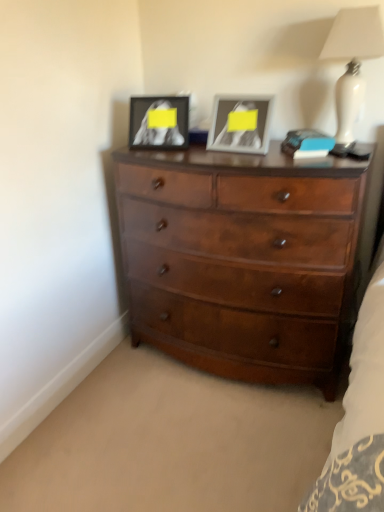
Describe the element at coordinates (240, 124) in the screenshot. I see `metallic silver picture frame at upper center, the second picture frame viewed from the left` at that location.

In order to face matte black picture frame at upper center, the 1th picture frame viewed from the left, should I rotate leftwards or rightwards?

To align with it, rotate left about 4.799°.

Describe the element at coordinates (307, 144) in the screenshot. The width and height of the screenshot is (384, 512). I see `blue matte book at upper right` at that location.

In order to click on shiny brown wooden chest of drawers at center in this screenshot , I will do `click(241, 259)`.

This screenshot has height=512, width=384. What are the coordinates of `white glossy lamp at upper right` in the screenshot? It's located at (352, 61).

Consider the image. Which object is positioned more to the left, white glossy lamp at upper right or metallic silver picture frame at upper center, arranged as the first picture frame when viewed from the right?

metallic silver picture frame at upper center, arranged as the first picture frame when viewed from the right.

Where is `the 2nd picture frame positioned below the white glossy lamp at upper right (from the image's perspective)`? the 2nd picture frame positioned below the white glossy lamp at upper right (from the image's perspective) is located at coordinates (240, 124).

Is white glossy lamp at upper right far away from metallic silver picture frame at upper center, the second picture frame viewed from the left?

No, there isn't a large distance between white glossy lamp at upper right and metallic silver picture frame at upper center, the second picture frame viewed from the left.

Is blue matte book at upper right further to camera compared to shiny brown wooden chest of drawers at center?

Yes, it is behind shiny brown wooden chest of drawers at center.

Could you tell me if blue matte book at upper right is facing shiny brown wooden chest of drawers at center?

No, blue matte book at upper right is not aimed at shiny brown wooden chest of drawers at center.

Consider the image. Which point is more distant from viewer, (295,141) or (274,212)?

The point (295,141) is farther from the camera.

Can you confirm if blue matte book at upper right is wider than shiny brown wooden chest of drawers at center?

In fact, blue matte book at upper right might be narrower than shiny brown wooden chest of drawers at center.

Is point (235, 122) behind point (329, 150)?

Yes.

Can we say metallic silver picture frame at upper center, the second picture frame viewed from the left, lies outside blue matte book at upper right?

Absolutely, metallic silver picture frame at upper center, the second picture frame viewed from the left, is external to blue matte book at upper right.

Is the surface of metallic silver picture frame at upper center, arranged as the first picture frame when viewed from the right, in direct contact with blue matte book at upper right?

No, metallic silver picture frame at upper center, arranged as the first picture frame when viewed from the right, is not beside blue matte book at upper right.

Between metallic silver picture frame at upper center, the second picture frame viewed from the left, and blue matte book at upper right, which one appears on the left side from the viewer's perspective?

metallic silver picture frame at upper center, the second picture frame viewed from the left, is more to the left.

From the picture: How different are the orientations of white glossy lamp at upper right and matte black picture frame at upper center, the 1th picture frame viewed from the left, in degrees?

The angle between the facing direction of white glossy lamp at upper right and the facing direction of matte black picture frame at upper center, the 1th picture frame viewed from the left, is 12.2 degrees.

Between white glossy lamp at upper right and matte black picture frame at upper center, the 1th picture frame viewed from the left, which one has larger size?

white glossy lamp at upper right is bigger.

Can you see white glossy lamp at upper right touching matte black picture frame at upper center, placed as the second picture frame when sorted from right to left?

No, white glossy lamp at upper right is not making contact with matte black picture frame at upper center, placed as the second picture frame when sorted from right to left.

Is point (343, 108) positioned after point (185, 108)?

No, (343, 108) is closer to viewer.

Is metallic silver picture frame at upper center, arranged as the first picture frame when viewed from the right, placed right next to white glossy lamp at upper right?

They are not placed beside each other.

Is metallic silver picture frame at upper center, arranged as the first picture frame when viewed from the right, not within white glossy lamp at upper right?

Yes, metallic silver picture frame at upper center, arranged as the first picture frame when viewed from the right, is outside of white glossy lamp at upper right.

Which is more to the left, metallic silver picture frame at upper center, arranged as the first picture frame when viewed from the right, or white glossy lamp at upper right?

metallic silver picture frame at upper center, arranged as the first picture frame when viewed from the right.

Is metallic silver picture frame at upper center, the second picture frame viewed from the left, looking in the opposite direction of white glossy lamp at upper right?

No, metallic silver picture frame at upper center, the second picture frame viewed from the left,'s orientation is not away from white glossy lamp at upper right.

Consider the image. Is white glossy lamp at upper right oriented towards shiny brown wooden chest of drawers at center?

No, white glossy lamp at upper right does not turn towards shiny brown wooden chest of drawers at center.

From the image's perspective, is white glossy lamp at upper right beneath shiny brown wooden chest of drawers at center?

No.

Is white glossy lamp at upper right far from shiny brown wooden chest of drawers at center?

That's not correct — white glossy lamp at upper right is a little close to shiny brown wooden chest of drawers at center.

Consider the image. Does white glossy lamp at upper right come in front of shiny brown wooden chest of drawers at center?

That is False.

Choose the correct answer: Is blue matte book at upper right inside matte black picture frame at upper center, the 1th picture frame viewed from the left, or outside it?

blue matte book at upper right is located beyond the bounds of matte black picture frame at upper center, the 1th picture frame viewed from the left.

From a real-world perspective, is blue matte book at upper right physically above matte black picture frame at upper center, the 1th picture frame viewed from the left?

No, from a real-world perspective, blue matte book at upper right is not on top of matte black picture frame at upper center, the 1th picture frame viewed from the left.

Based on the photo, could you tell me if blue matte book at upper right is facing matte black picture frame at upper center, the 1th picture frame viewed from the left?

No, blue matte book at upper right is not facing towards matte black picture frame at upper center, the 1th picture frame viewed from the left.

Is blue matte book at upper right shorter than matte black picture frame at upper center, placed as the second picture frame when sorted from right to left?

Correct, blue matte book at upper right is not as tall as matte black picture frame at upper center, placed as the second picture frame when sorted from right to left.

The image size is (384, 512). I want to click on the 1st picture frame positioned below the white glossy lamp at upper right (from a real-world perspective), so click(240, 124).

Identify the location of book behind the shiny brown wooden chest of drawers at center. (307, 144).

When comparing their distances from blue matte book at upper right, does white glossy lamp at upper right or shiny brown wooden chest of drawers at center seem further?

Among the two, shiny brown wooden chest of drawers at center is located further to blue matte book at upper right.

From the picture: Considering their positions, is white glossy lamp at upper right positioned closer to metallic silver picture frame at upper center, the second picture frame viewed from the left, than matte black picture frame at upper center, the 1th picture frame viewed from the left?

matte black picture frame at upper center, the 1th picture frame viewed from the left, lies closer to metallic silver picture frame at upper center, the second picture frame viewed from the left, than the other object.

From the image, which object appears to be farther from white glossy lamp at upper right, matte black picture frame at upper center, the 1th picture frame viewed from the left, or metallic silver picture frame at upper center, arranged as the first picture frame when viewed from the right?

matte black picture frame at upper center, the 1th picture frame viewed from the left, is positioned further to the anchor white glossy lamp at upper right.

Considering their positions, is blue matte book at upper right positioned further to matte black picture frame at upper center, the 1th picture frame viewed from the left, than shiny brown wooden chest of drawers at center?

The object further to matte black picture frame at upper center, the 1th picture frame viewed from the left, is blue matte book at upper right.

Looking at the image, which one is located closer to shiny brown wooden chest of drawers at center, white glossy lamp at upper right or blue matte book at upper right?

blue matte book at upper right is positioned closer to the anchor shiny brown wooden chest of drawers at center.

From the image, which object appears to be nearer to metallic silver picture frame at upper center, the second picture frame viewed from the left, matte black picture frame at upper center, the 1th picture frame viewed from the left, or blue matte book at upper right?

blue matte book at upper right is closer to metallic silver picture frame at upper center, the second picture frame viewed from the left.

When comparing their distances from matte black picture frame at upper center, the 1th picture frame viewed from the left, does shiny brown wooden chest of drawers at center or blue matte book at upper right seem closer?

Based on the image, shiny brown wooden chest of drawers at center appears to be nearer to matte black picture frame at upper center, the 1th picture frame viewed from the left.

Based on their spatial positions, is white glossy lamp at upper right or blue matte book at upper right closer to metallic silver picture frame at upper center, arranged as the first picture frame when viewed from the right?

blue matte book at upper right is positioned closer to the anchor metallic silver picture frame at upper center, arranged as the first picture frame when viewed from the right.

What are the coordinates of `book that lies between matte black picture frame at upper center, the 1th picture frame viewed from the left, and shiny brown wooden chest of drawers at center from top to bottom` in the screenshot? It's located at (307, 144).

Where is `picture frame between matte black picture frame at upper center, placed as the second picture frame when sorted from right to left, and white glossy lamp at upper right, in the horizontal direction`? The image size is (384, 512). picture frame between matte black picture frame at upper center, placed as the second picture frame when sorted from right to left, and white glossy lamp at upper right, in the horizontal direction is located at coordinates [x=240, y=124].

Locate an element on the screen. This screenshot has width=384, height=512. chest of drawers between matte black picture frame at upper center, placed as the second picture frame when sorted from right to left, and white glossy lamp at upper right from left to right is located at coordinates (241, 259).

Identify the location of book between metallic silver picture frame at upper center, arranged as the first picture frame when viewed from the right, and shiny brown wooden chest of drawers at center from top to bottom. tap(307, 144).